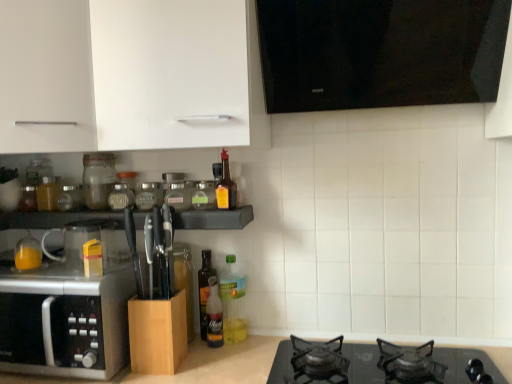
Question: From a real-world perspective, does transparent glass jar at center, positioned as the second glass jar in left-to-right order, sit lower than wooden knife block at center?

Choices:
 (A) yes
 (B) no

Answer: (B)

Question: Is transparent glass jar at center, arranged as the 2th glass jar when viewed from the right, to the right of wooden knife block at center from the viewer's perspective?

Choices:
 (A) yes
 (B) no

Answer: (A)

Question: Would you say transparent glass jar at center, positioned as the second glass jar in left-to-right order, is outside wooden knife block at center?

Choices:
 (A) yes
 (B) no

Answer: (A)

Question: Does transparent glass jar at center, arranged as the 2th glass jar when viewed from the right, have a larger size compared to wooden knife block at center?

Choices:
 (A) no
 (B) yes

Answer: (A)

Question: From the image's perspective, is transparent glass jar at center, positioned as the second glass jar in left-to-right order, located above wooden knife block at center?

Choices:
 (A) yes
 (B) no

Answer: (A)

Question: Is translucent plastic bottle at center, which ranks as the 4th bottle in left-to-right order, in front of or behind transparent glass mug at left in the image?

Choices:
 (A) front
 (B) behind

Answer: (B)

Question: From the image's perspective, is translucent plastic bottle at center, the 3th bottle in the right-to-left sequence, located above or below transparent glass mug at left?

Choices:
 (A) above
 (B) below

Answer: (B)

Question: From a real-world perspective, is translucent plastic bottle at center, the 3th bottle in the right-to-left sequence, above or below transparent glass mug at left?

Choices:
 (A) above
 (B) below

Answer: (B)

Question: Considering the positions of translucent plastic bottle at center, the 3th bottle in the right-to-left sequence, and transparent glass mug at left in the image, is translucent plastic bottle at center, the 3th bottle in the right-to-left sequence, taller or shorter than transparent glass mug at left?

Choices:
 (A) short
 (B) tall

Answer: (B)

Question: From a real-world perspective, is wooden knife block at center physically located above or below translucent plastic bottle at center, which appears as the 6th bottle when viewed from the left?

Choices:
 (A) above
 (B) below

Answer: (A)

Question: Considering the positions of point (176, 223) and point (226, 296), is point (176, 223) closer or farther from the camera than point (226, 296)?

Choices:
 (A) closer
 (B) farther

Answer: (A)

Question: From the image's perspective, is wooden knife block at center above or below translucent plastic bottle at center, which ranks as the 1th bottle in right-to-left order?

Choices:
 (A) below
 (B) above

Answer: (B)

Question: Considering the positions of wooden knife block at center and translucent plastic bottle at center, which ranks as the 1th bottle in right-to-left order, in the image, is wooden knife block at center bigger or smaller than translucent plastic bottle at center, which ranks as the 1th bottle in right-to-left order,?

Choices:
 (A) big
 (B) small

Answer: (A)

Question: Considering the relative positions of translucent plastic bottle at center, the 3th bottle in the right-to-left sequence, and translucent glass jar at upper left, which appears as the first bottle when viewed from the left, in the image provided, is translucent plastic bottle at center, the 3th bottle in the right-to-left sequence, to the left or to the right of translucent glass jar at upper left, which appears as the first bottle when viewed from the left,?

Choices:
 (A) right
 (B) left

Answer: (A)

Question: Is translucent plastic bottle at center, the 3th bottle in the right-to-left sequence, bigger or smaller than translucent glass jar at upper left, which appears as the first bottle when viewed from the left?

Choices:
 (A) big
 (B) small

Answer: (B)